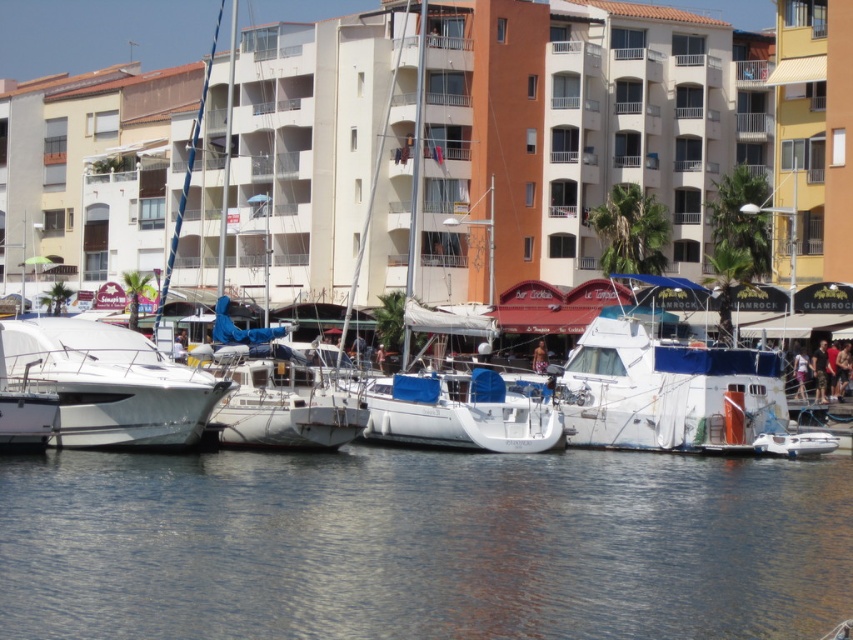
You are standing on the pier and looking towards the white smooth building at center and the white glossy boat at left. Which one is positioned higher in the scene?

The white smooth building at center is positioned higher than the white glossy boat at left because it is located above it.

You are standing at the edge of the marina and notice a white matte boat at center. Can you confirm if this boat is located at the coordinates point (665, 387)?

Yes, the white matte boat at center is located at point (665, 387).

You are a photographer standing at the edge of the pier. You want to capture both the white matte boat at center and the white matte sailboat at center in a single shot. Which one should you position closer to the left side of the frame to include both?

You should position the white matte sailboat at center closer to the left side of the frame because the white matte boat at center is already to the right of it.